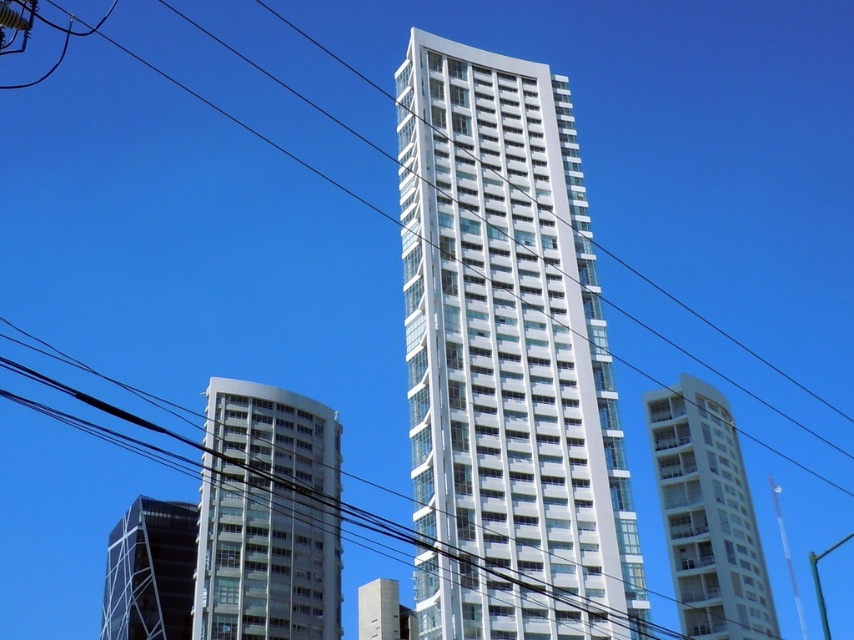
Is point (531, 625) positioned after point (182, 531)?

No, (531, 625) is closer to viewer.

Is the position of white glass building at center more distant than that of black glass building at lower left?

No, white glass building at center is closer to the viewer.

Locate an element on the screen. This screenshot has height=640, width=854. white glass building at center is located at coordinates (507, 358).

Is white glass building at center shorter than white glass building at right?

No, white glass building at center is not shorter than white glass building at right.

Does white glass building at center come behind white glass building at right?

No, it is not.

Identify the location of white glass building at center. The width and height of the screenshot is (854, 640). (507, 358).

Can you confirm if white glass building at lower left is wider than black glass building at lower left?

Yes.

This screenshot has width=854, height=640. Describe the element at coordinates (262, 560) in the screenshot. I see `white glass building at lower left` at that location.

Locate an element on the screen. The height and width of the screenshot is (640, 854). white glass building at lower left is located at coordinates (262, 560).